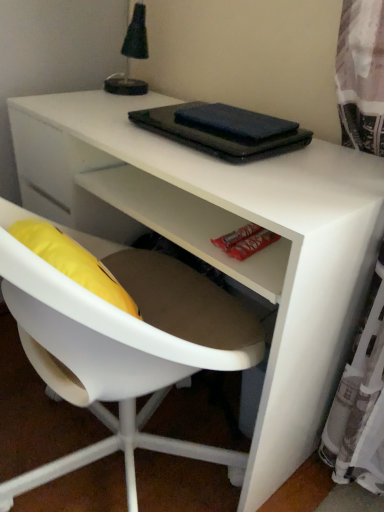
Find the location of a particular element. free space that is to the left of black matte notebook at center, the 2th notebook positioned from the top is located at coordinates (109, 123).